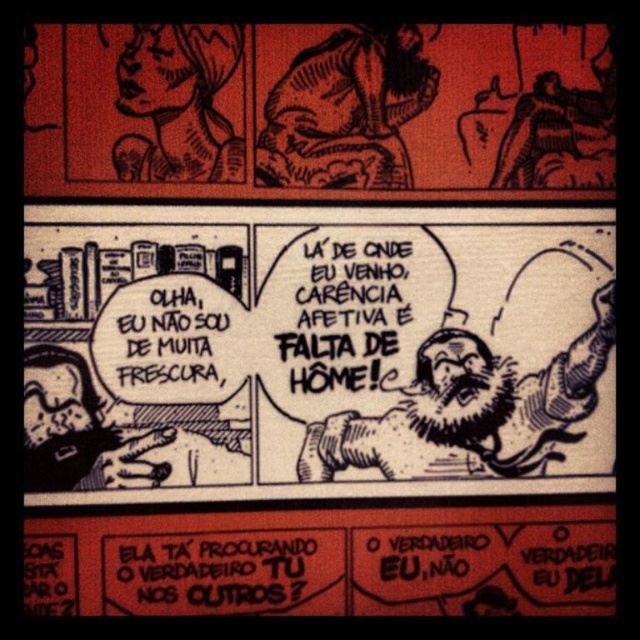
You are an art student analyzing this comic strip. You notice two black ink speech bubbles. Which one is closer to you, the black ink speech bubble at center or the black ink speech bubble at upper center?

The black ink speech bubble at center is closer to you because it is further to the viewer than the black ink speech bubble at upper center.

In the comic strip, there are two points marked at coordinates point (280, 48) and point (520, 580). Which of these points is nearer to the viewer?

Point (280, 48) is closer to the viewer than point (520, 580).